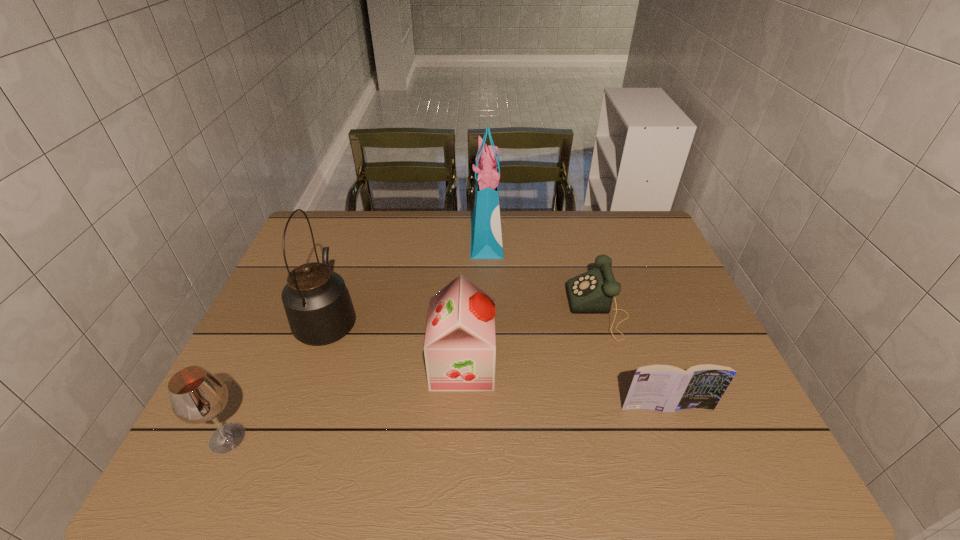
Find the location of a particular element. Image resolution: width=960 pixels, height=540 pixels. kettle that is at the left edge is located at coordinates (319, 310).

You are a GUI agent. You are given a task and a screenshot of the screen. Output one action in this format:
    pyautogui.click(x=<x>, y=<y>)
    Task: Click on the wineglass present at the left edge
    The height and width of the screenshot is (540, 960).
    Given the screenshot: What is the action you would take?
    point(197,396)

Image resolution: width=960 pixels, height=540 pixels. What are the coordinates of `object present at the right edge` in the screenshot? It's located at (665, 388).

What are the coordinates of `object that is at the near left corner` in the screenshot? It's located at (197, 396).

Where is `vacant space at the far edge of the desktop`? This screenshot has width=960, height=540. vacant space at the far edge of the desktop is located at coordinates (600, 222).

The width and height of the screenshot is (960, 540). I want to click on free region at the near edge, so click(453, 445).

Find the location of a particular element. The height and width of the screenshot is (540, 960). vacant space at the right edge of the desktop is located at coordinates (668, 279).

Find the location of `vacant space at the far left corner of the desktop`. vacant space at the far left corner of the desktop is located at coordinates (319, 254).

You are a GUI agent. You are given a task and a screenshot of the screen. Output one action in this format:
    pyautogui.click(x=<x>, y=<y>)
    Task: Click on the free space at the far right corner of the desktop
    The image size is (960, 540).
    Given the screenshot: What is the action you would take?
    pyautogui.click(x=652, y=249)

Where is `free area in between the telephone and the book`? This screenshot has height=540, width=960. free area in between the telephone and the book is located at coordinates (633, 359).